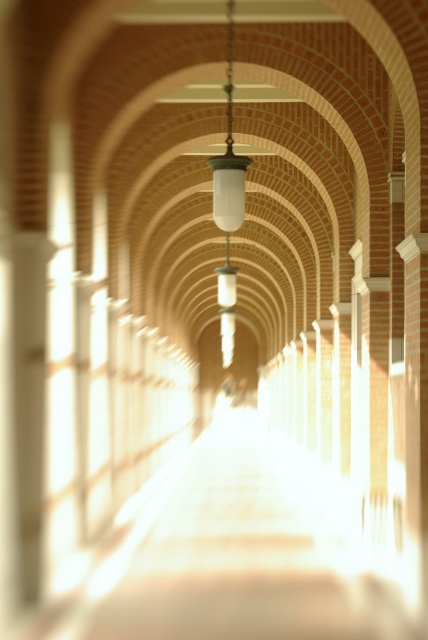
You are standing at the entrance of the corridor and see the white glossy path at center. If you walk straight ahead, will you eventually reach the bright light at the far end?

Yes, because the perspective and alignment of the white glossy path at center lead directly towards the bright overexposed light at the far end, indicating that walking straight ahead would follow the path towards the light.